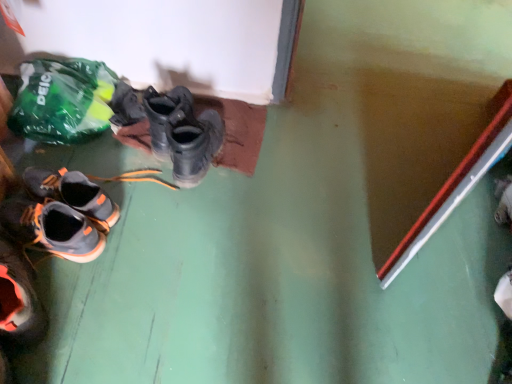
Question: In the image, is matte black boots at center on the left side or the right side of gray suede shoes at lower left?

Choices:
 (A) right
 (B) left

Answer: (A)

Question: Is matte black boots at center inside or outside of gray suede shoes at lower left?

Choices:
 (A) outside
 (B) inside

Answer: (A)

Question: Estimate the real-world distances between objects in this image. Which object is closer to the matte black boots at center?

Choices:
 (A) green plastic bag at upper left
 (B) gray suede shoes at lower left

Answer: (A)

Question: Which of these objects is positioned closest to the matte black boots at center?

Choices:
 (A) green plastic bag at upper left
 (B) gray suede shoes at lower left

Answer: (A)